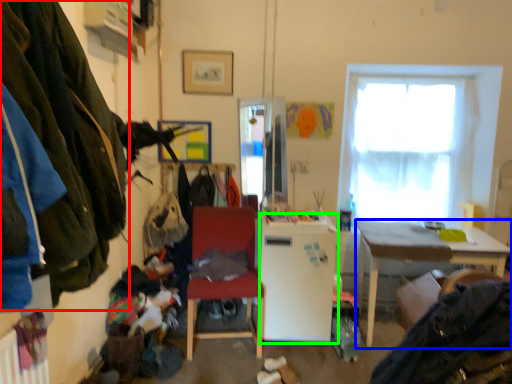
Question: Estimate the real-world distances between objects in this image. Which object is closer to clothing (highlighted by a red box), desk (highlighted by a blue box) or refrigerator (highlighted by a green box)?

Choices:
 (A) desk
 (B) refrigerator

Answer: (B)